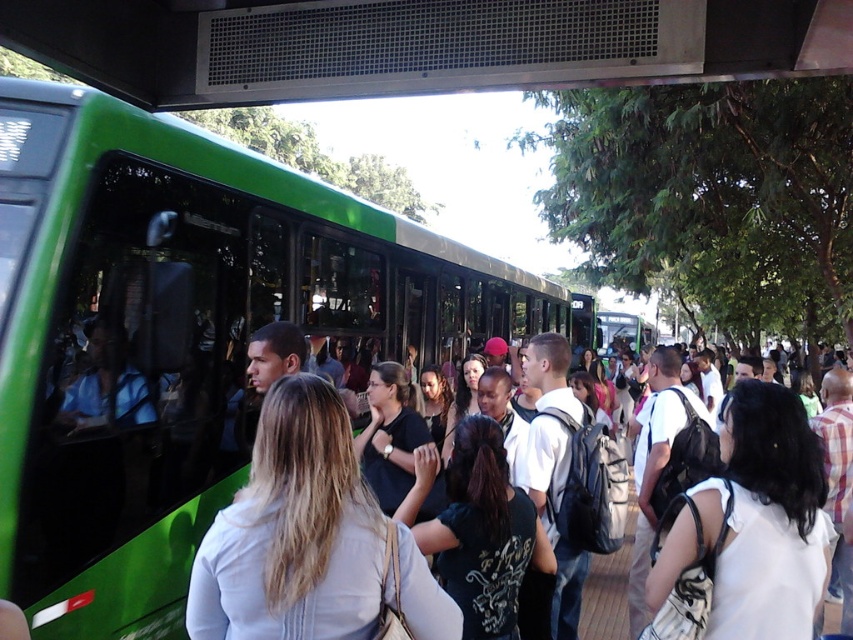
Does point (149, 458) come in front of point (419, 584)?

No, (149, 458) is further to viewer.

Identify the location of green matte bus at left. (180, 337).

Is point (381, 209) closer to camera compared to point (323, 496)?

No.

I want to click on green matte bus at left, so click(x=180, y=337).

Can you confirm if light brown leather jacket at center is positioned to the left of white fabric shirt at center?

Indeed, light brown leather jacket at center is positioned on the left side of white fabric shirt at center.

Can you confirm if light brown leather jacket at center is positioned to the right of white fabric shirt at center?

No, light brown leather jacket at center is not to the right of white fabric shirt at center.

Locate an element on the screen. light brown leather jacket at center is located at coordinates (306, 538).

This screenshot has height=640, width=853. I want to click on light brown leather jacket at center, so click(x=306, y=538).

Does white fabric shirt at center lie in front of matte black backpack at center?

That is True.

Who is more distant from viewer, (x=747, y=458) or (x=262, y=387)?

Point (x=262, y=387)

Between point (769, 588) and point (596, 595), which one is positioned behind?

The point (596, 595) is more distant.

Identify the location of white fabric shirt at center. (753, 522).